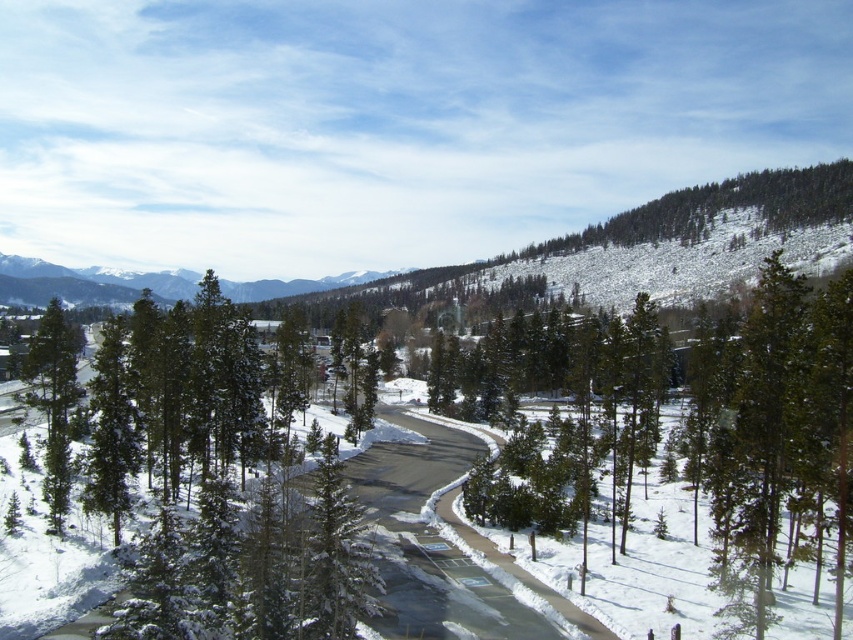
Can you confirm if green textured pine at center is wider than green matte tree at left?

Correct, the width of green textured pine at center exceeds that of green matte tree at left.

Is the position of green textured pine at center more distant than that of green matte tree at left?

→ No.

Find the location of a particular element. The image size is (853, 640). green textured pine at center is located at coordinates (770, 429).

Identify the location of green textured pine at center. (770, 429).